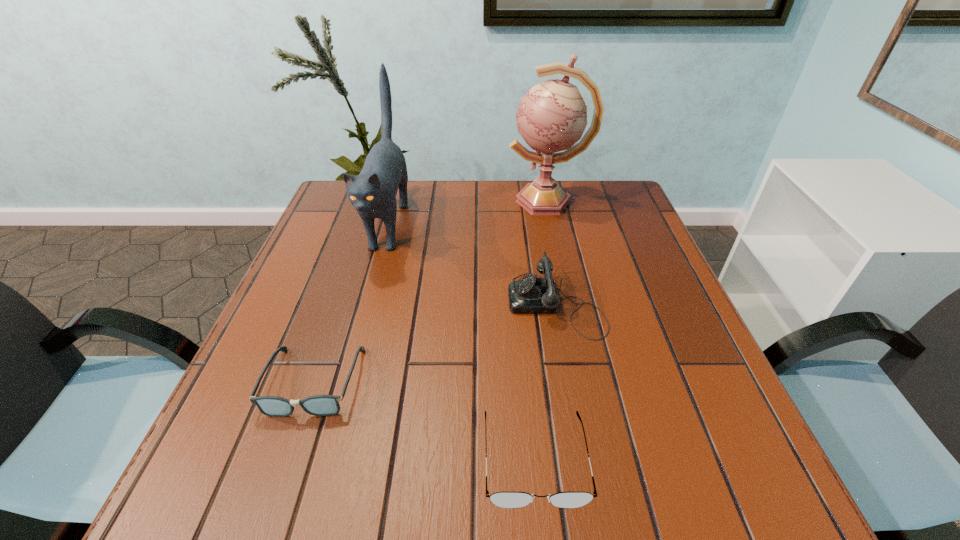
Locate an element on the screen. Image resolution: width=960 pixels, height=540 pixels. free space that is in between the right spectacles and the cat is located at coordinates (462, 342).

Locate an element on the screen. The image size is (960, 540). free area in between the globe and the telephone is located at coordinates (551, 252).

What are the coordinates of `vacant space that's between the right spectacles and the cat` in the screenshot? It's located at (462, 342).

This screenshot has height=540, width=960. I want to click on vacant region between the third shortest object and the right spectacles, so click(x=545, y=381).

Identify the location of free point between the left spectacles and the right spectacles. (424, 421).

You are a GUI agent. You are given a task and a screenshot of the screen. Output one action in this format:
    pyautogui.click(x=<x>, y=<y>)
    Task: Click on the empty space that is in between the telephone and the left spectacles
    The image size is (960, 540).
    Given the screenshot: What is the action you would take?
    pyautogui.click(x=435, y=342)

Select which object is the third closest to the globe. Please provide its 2D coordinates. Your answer should be formatted as a tuple, i.e. [(x, y)], where the tuple contains the x and y coordinates of a point satisfying the conditions above.

[(319, 405)]

This screenshot has width=960, height=540. I want to click on object that ranks as the third closest to the globe, so click(319, 405).

You are a GUI agent. You are given a task and a screenshot of the screen. Output one action in this format:
    pyautogui.click(x=<x>, y=<y>)
    Task: Click on the free location that satisfies the following two spatial constraints: 1. on the front-facing side of the globe; 2. on the lenses of the right spectacles
    The height and width of the screenshot is (540, 960).
    Given the screenshot: What is the action you would take?
    pyautogui.click(x=603, y=459)

Identify the location of free space that satisfies the following two spatial constraints: 1. on the front-facing side of the globe; 2. on the face of the left spectacles. tap(586, 382).